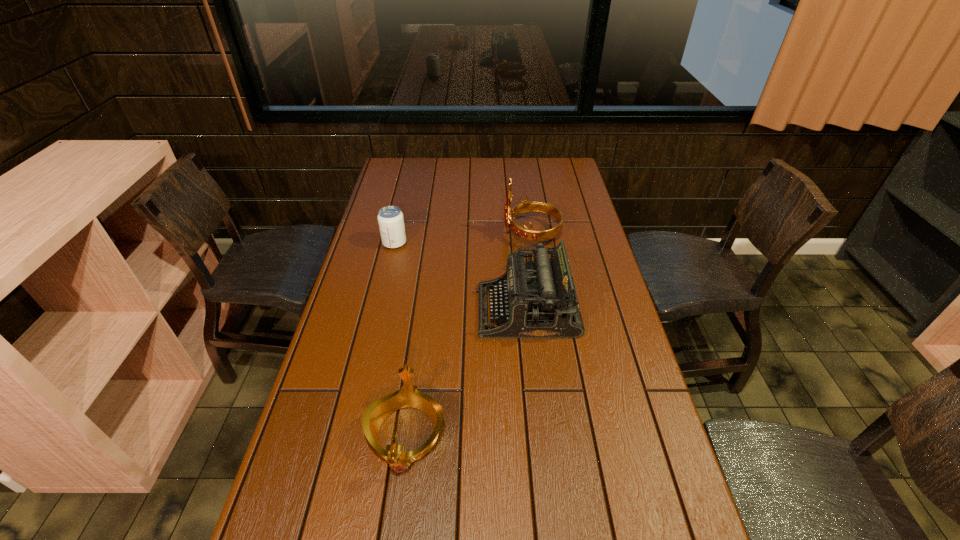
Find the location of `the closest object to the nearest object`. the closest object to the nearest object is located at coordinates (539, 300).

Locate which object ranks in proximity to the tallest object. Please provide its 2D coordinates. Your answer should be formatted as a tuple, i.e. [(x, y)], where the tuple contains the x and y coordinates of a point satisfying the conditions above.

[(539, 300)]

The height and width of the screenshot is (540, 960). Find the location of `free space in the image that satisfies the following two spatial constraints: 1. on the front-facing side of the farther tiara; 2. on the front side of the soda can`. free space in the image that satisfies the following two spatial constraints: 1. on the front-facing side of the farther tiara; 2. on the front side of the soda can is located at coordinates (533, 243).

Image resolution: width=960 pixels, height=540 pixels. I want to click on vacant region that satisfies the following two spatial constraints: 1. on the keyboard of the typewriter; 2. at the front emblem of the shorter tiara, so click(540, 435).

I want to click on vacant space that satisfies the following two spatial constraints: 1. on the front-facing side of the tallest object; 2. on the front side of the soda can, so click(533, 243).

Where is `vacant space that satisfies the following two spatial constraints: 1. on the keyboard of the typewriter; 2. at the front emblem of the shorter tiara`? This screenshot has width=960, height=540. vacant space that satisfies the following two spatial constraints: 1. on the keyboard of the typewriter; 2. at the front emblem of the shorter tiara is located at coordinates (540, 435).

Find the location of a particular element. The width and height of the screenshot is (960, 540). vacant space that satisfies the following two spatial constraints: 1. on the keyboard of the third shortest object; 2. at the front emblem of the shorter tiara is located at coordinates (540, 435).

This screenshot has height=540, width=960. I want to click on vacant region that satisfies the following two spatial constraints: 1. on the keyboard of the third shortest object; 2. at the front emblem of the nearest object, so click(540, 435).

Identify the location of vacant space that satisfies the following two spatial constraints: 1. on the keyboard of the second tallest object; 2. at the front emblem of the nearer tiara. (540, 435).